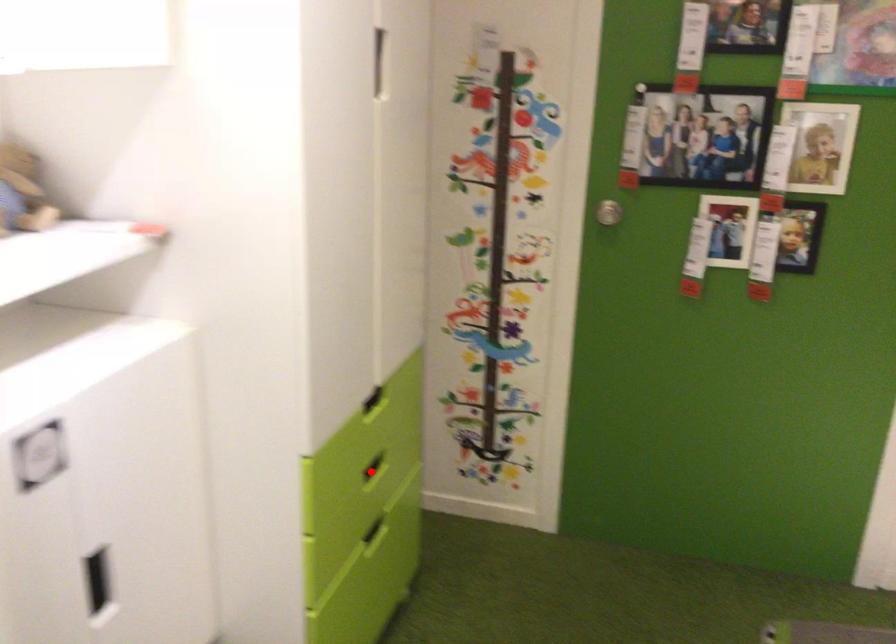
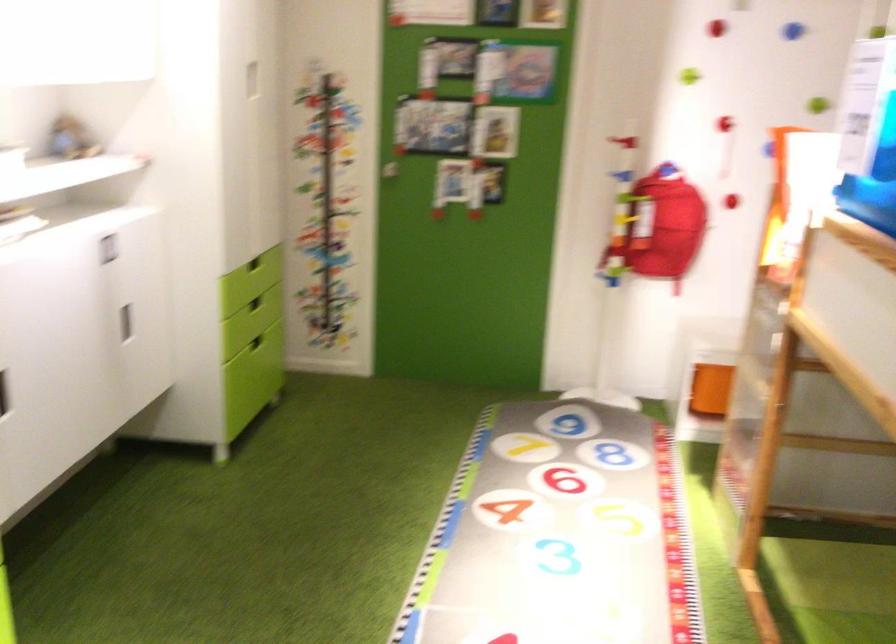
Question: I am providing you with two images of the same scene from different viewpoints. A red point is shown in image1. For the corresponding object point in image2, is it positioned nearer or farther from the camera?

Choices:
 (A) Nearer
 (B) Farther

Answer: (B)